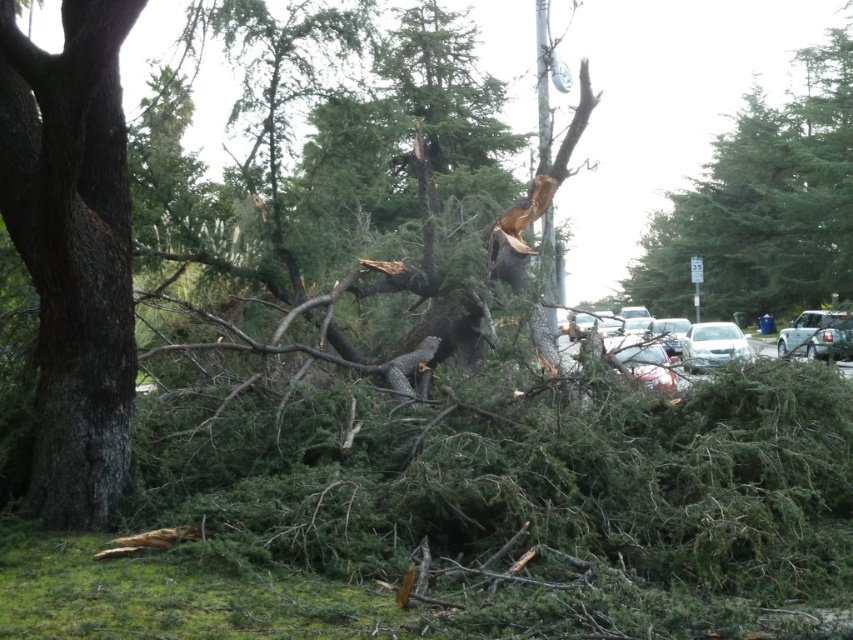
Can you confirm if green textured tree at upper right is thinner than green matte car at right?

Incorrect, green textured tree at upper right's width is not less than green matte car at right's.

Does green textured tree at upper right appear under green matte car at right?

No.

You are a GUI agent. You are given a task and a screenshot of the screen. Output one action in this format:
    pyautogui.click(x=<x>, y=<y>)
    Task: Click on the green textured tree at upper right
    This screenshot has height=640, width=853.
    Given the screenshot: What is the action you would take?
    pyautogui.click(x=764, y=204)

Where is `green textured tree at upper right`? green textured tree at upper right is located at coordinates (764, 204).

Who is positioned more to the left, green textured tree at upper right or white matte car at center?

white matte car at center

Does green textured tree at upper right have a larger size compared to white matte car at center?

Yes.

The height and width of the screenshot is (640, 853). Describe the element at coordinates (764, 204) in the screenshot. I see `green textured tree at upper right` at that location.

Image resolution: width=853 pixels, height=640 pixels. I want to click on green textured tree at upper right, so click(764, 204).

Does green matte car at right have a lesser width compared to white matte car at center?

In fact, green matte car at right might be wider than white matte car at center.

Between point (824, 321) and point (682, 340), which one is positioned behind?

The point (682, 340) is more distant.

Where is `green matte car at right`? green matte car at right is located at coordinates click(x=817, y=336).